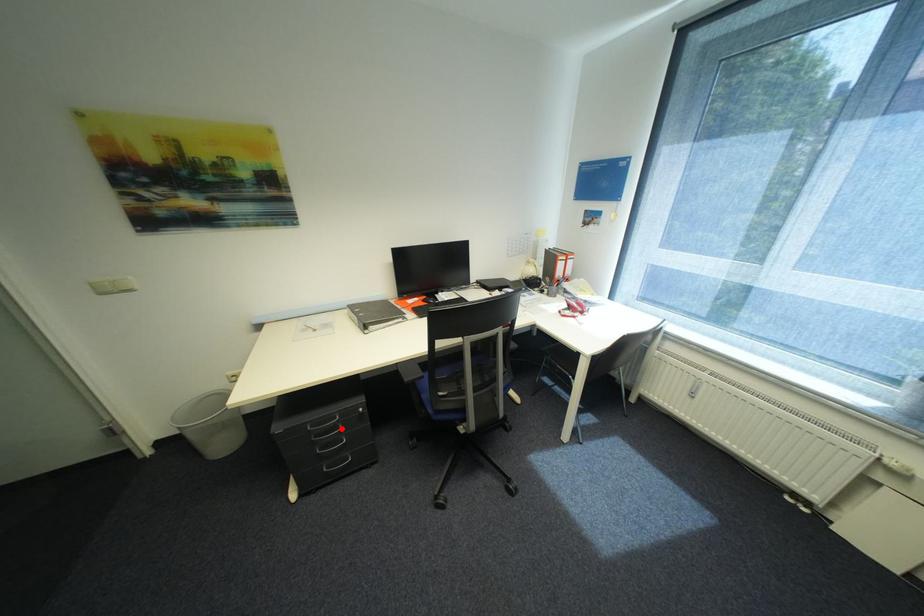
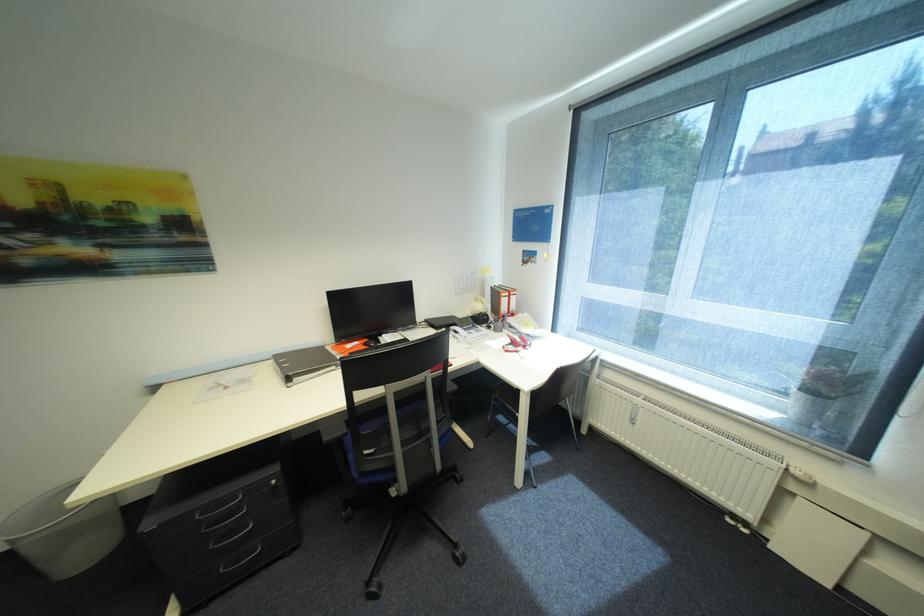
Locate, in the second image, the point that corresponds to the highlighted location in the first image.

(242, 512)